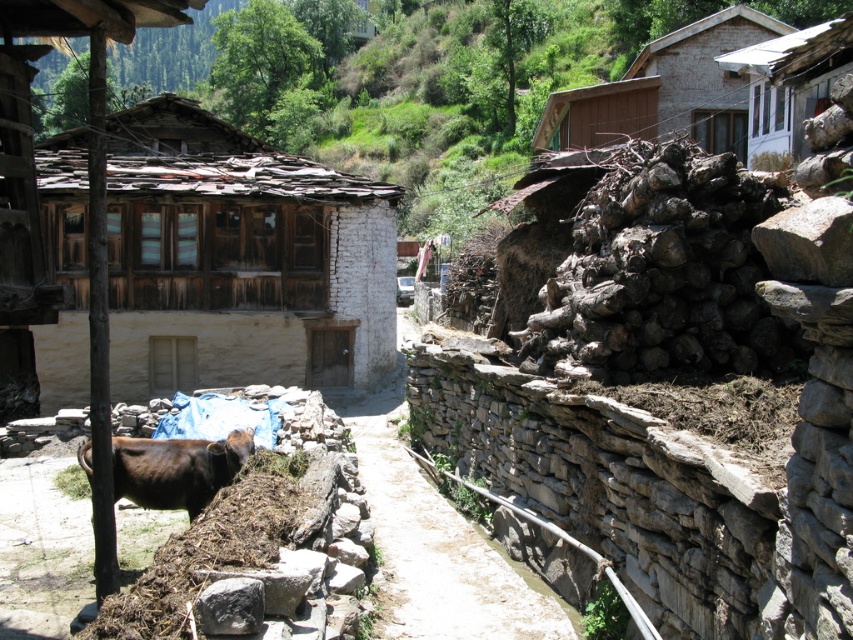
Who is positioned more to the right, dirt path at center or brown wooden hut at upper right?

From the viewer's perspective, brown wooden hut at upper right appears more on the right side.

Is dirt path at center to the left of brown wooden hut at upper right from the viewer's perspective?

Yes, dirt path at center is to the left of brown wooden hut at upper right.

Identify the location of dirt path at center. (437, 545).

Does weathered wood hut at left have a greater width compared to dirt path at center?

Correct, the width of weathered wood hut at left exceeds that of dirt path at center.

At what (x,y) coordinates should I click in order to perform the action: click on weathered wood hut at left. Please return your answer as a coordinate pair (x, y). This screenshot has width=853, height=640. Looking at the image, I should click on (241, 259).

Can you confirm if weathered wood hut at left is taller than brown furry yak at lower left?

Yes, weathered wood hut at left is taller than brown furry yak at lower left.

Locate an element on the screen. The height and width of the screenshot is (640, 853). weathered wood hut at left is located at coordinates pyautogui.click(x=241, y=259).

Which is in front, point (352, 248) or point (198, 451)?

Point (198, 451) is more forward.

Where is `weathered wood hut at left`? Image resolution: width=853 pixels, height=640 pixels. weathered wood hut at left is located at coordinates (241, 259).